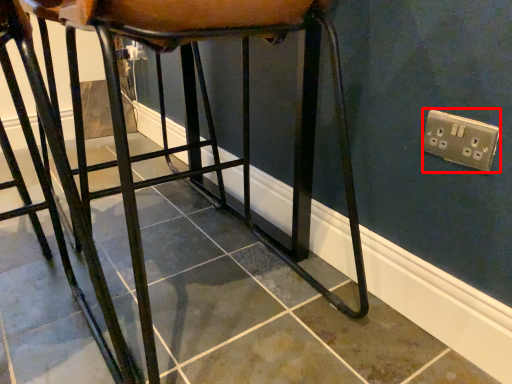
Question: From the image's perspective, what is the correct spatial relationship of electric outlet (annotated by the red box) in relation to furniture?

Choices:
 (A) above
 (B) below

Answer: (B)